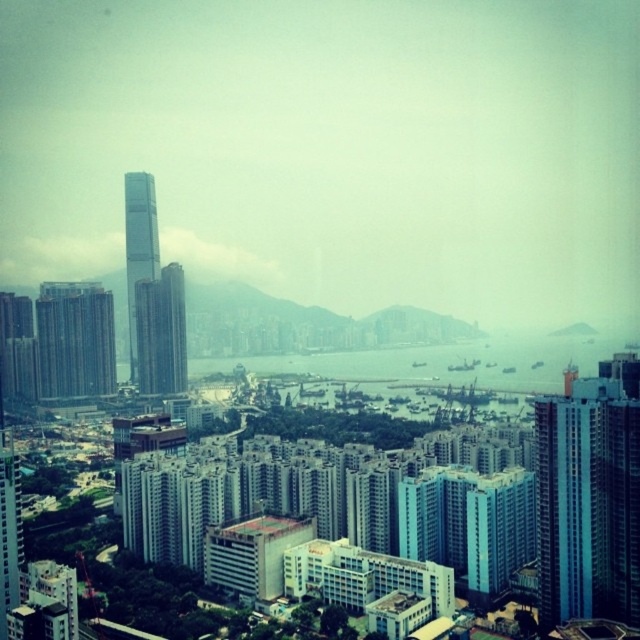
Looking at this image, you are a drone operator tasked with flying a drone between the blue glassy building at right and the glassy skyscraper at left. The drone has a maximum flight distance of 250 meters. Can the drone successfully travel from one building to the other without running out of battery?

The distance between the blue glassy building at right and the glassy skyscraper at left is 245.52 meters, which is within the drone operator drone has a maximum flight distance of 250 meters. The drone can successfully travel between them without running out of battery.